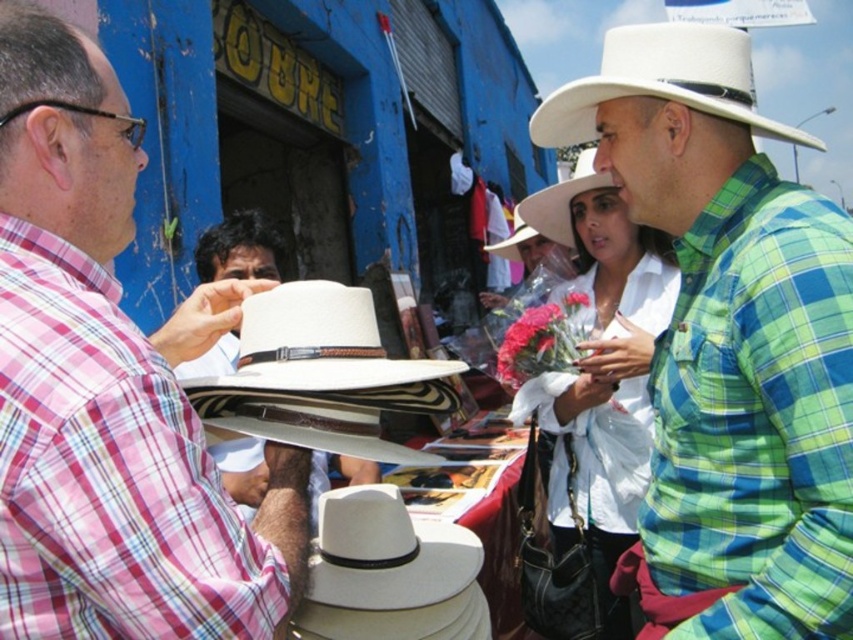
Question: Which of the following is the closest to the observer?

Choices:
 (A) (613, 161)
 (B) (45, 182)
 (C) (383, 522)
 (D) (270, 321)

Answer: (B)

Question: Considering the real-world distances, which object is farthest from the white matte cowboy hat at center?

Choices:
 (A) white felt cowboy hat at center
 (B) white matte cowboy hat at upper center
 (C) white matte hat at center
 (D) white woven hat at center

Answer: (A)

Question: Estimate the real-world distances between objects in this image. Which object is closer to the white woven hat at center?

Choices:
 (A) white felt cowboy hat at center
 (B) matte white hat at left
 (C) white matte hat at center

Answer: (A)

Question: Is white woven hat at center behind white matte cowboy hat at upper center?

Choices:
 (A) yes
 (B) no

Answer: (B)

Question: Is matte white hat at left bigger than white matte hat at center?

Choices:
 (A) no
 (B) yes

Answer: (A)

Question: Does matte white hat at left come behind white matte cowboy hat at center?

Choices:
 (A) no
 (B) yes

Answer: (A)